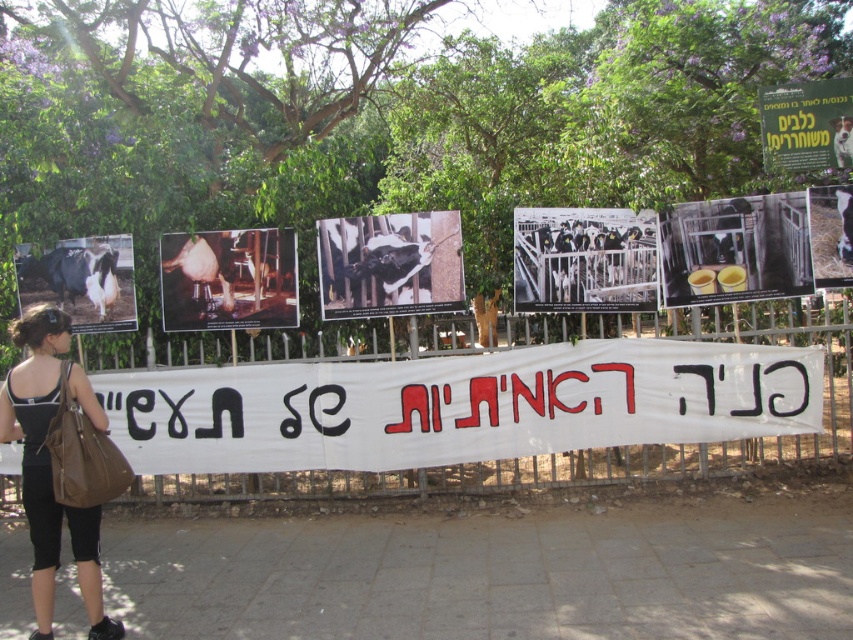
Question: Does black leather bag at lower left have a smaller size compared to white glossy cow at center?

Choices:
 (A) no
 (B) yes

Answer: (A)

Question: Among these points, which one is farthest from the camera?

Choices:
 (A) (773, 156)
 (B) (178, 250)
 (C) (447, 252)
 (D) (302, 376)

Answer: (B)

Question: In this image, where is metallic yellow container at center located relative to metallic silver cow at center?

Choices:
 (A) right
 (B) left

Answer: (A)

Question: Can you confirm if white fabric banner at center is bigger than metallic silver cow at center?

Choices:
 (A) no
 (B) yes

Answer: (B)

Question: Which object appears closest to the camera in this image?

Choices:
 (A) metallic yellow container at center
 (B) black leather bag at lower left
 (C) black and white cow at center
 (D) white glossy cow at center

Answer: (B)

Question: Which object is farther from the camera taking this photo?

Choices:
 (A) metallic yellow container at center
 (B) green paper sign at upper right
 (C) white glossy cow at center

Answer: (C)